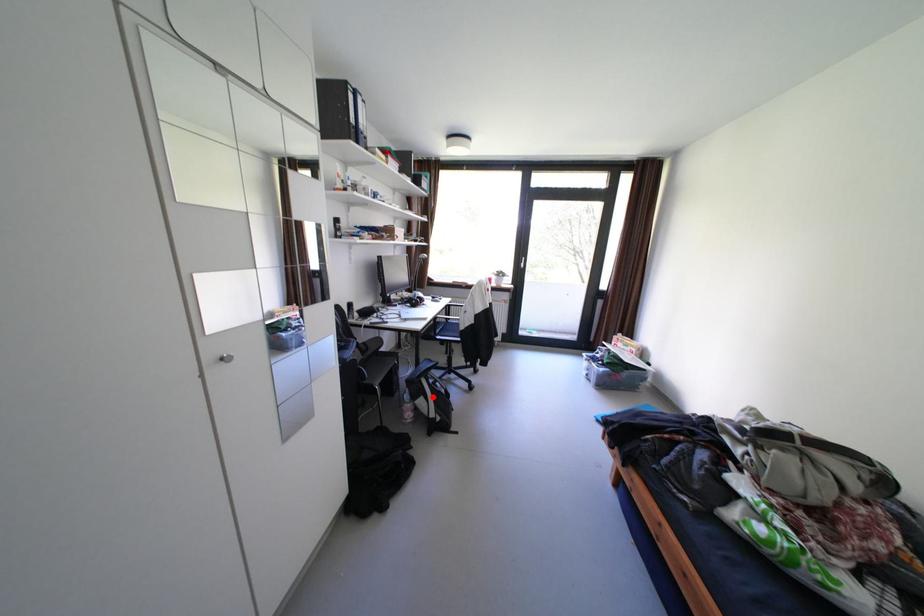
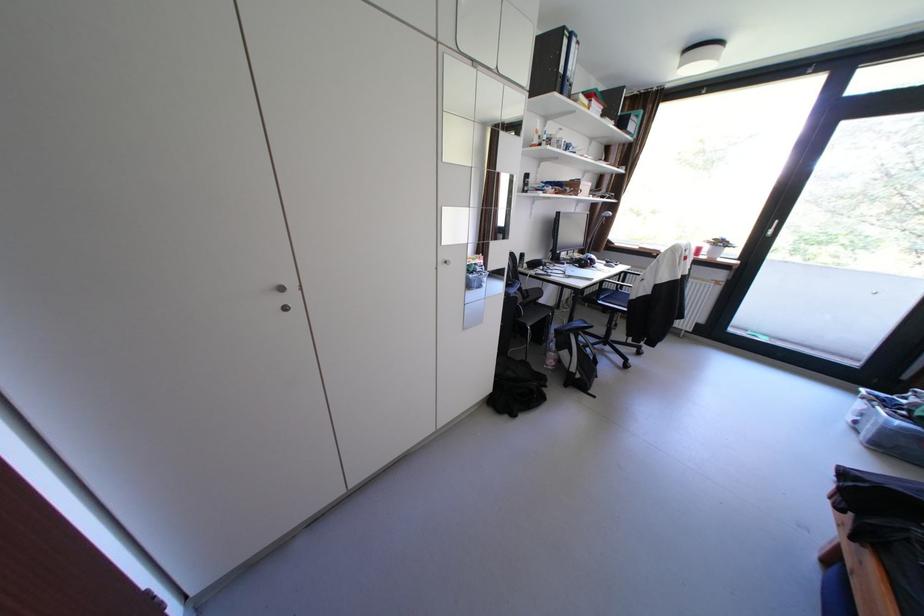
Question: I am providing you with two images of the same scene from different viewpoints. A red point is shown in image1. For the corresponding object point in image2, is it positioned nearer or farther from the camera?

Choices:
 (A) Nearer
 (B) Farther

Answer: (B)